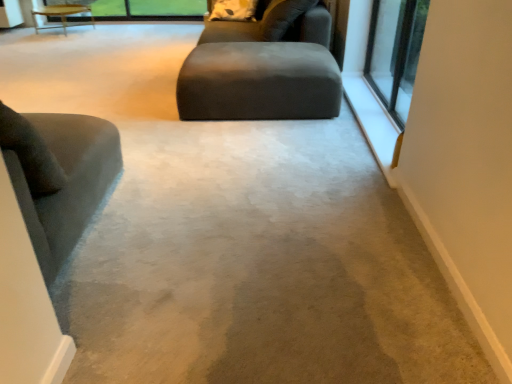
Find the location of `free space to the left of matte gray ottoman at center`. free space to the left of matte gray ottoman at center is located at coordinates (x=138, y=97).